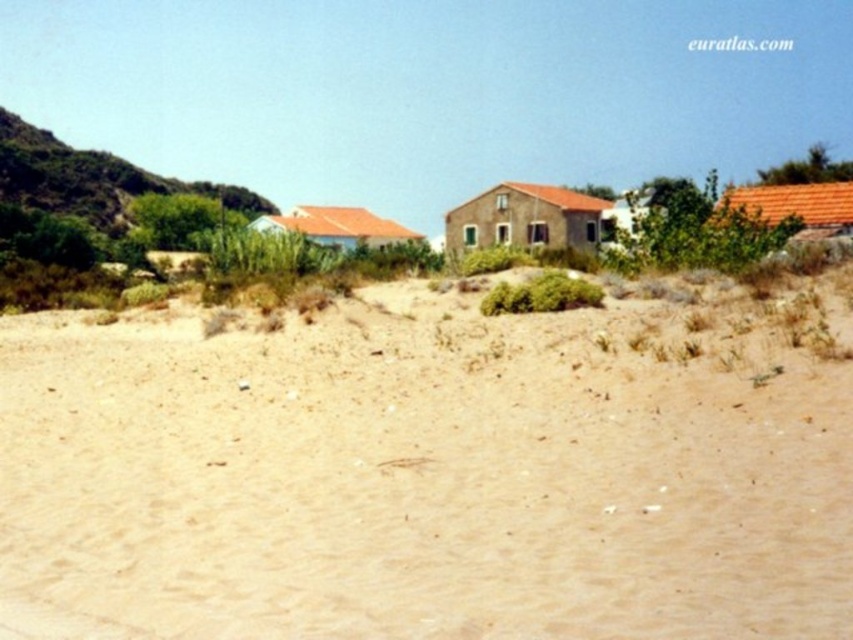
Question: Does light brown sand at lower center appear on the left side of green shrubbery at left?

Choices:
 (A) no
 (B) yes

Answer: (A)

Question: Does light brown sand at lower center appear over green shrubbery at left?

Choices:
 (A) no
 (B) yes

Answer: (A)

Question: Can you confirm if light brown sand at lower center is smaller than green shrubbery at left?

Choices:
 (A) no
 (B) yes

Answer: (B)

Question: Which object is closer to the camera taking this photo?

Choices:
 (A) green shrubbery at left
 (B) light brown sand at lower center

Answer: (B)

Question: Which point appears farthest from the camera in this image?

Choices:
 (A) (9, 195)
 (B) (631, 524)

Answer: (A)

Question: Among these objects, which one is nearest to the camera?

Choices:
 (A) green shrubbery at left
 (B) light brown sand at lower center

Answer: (B)